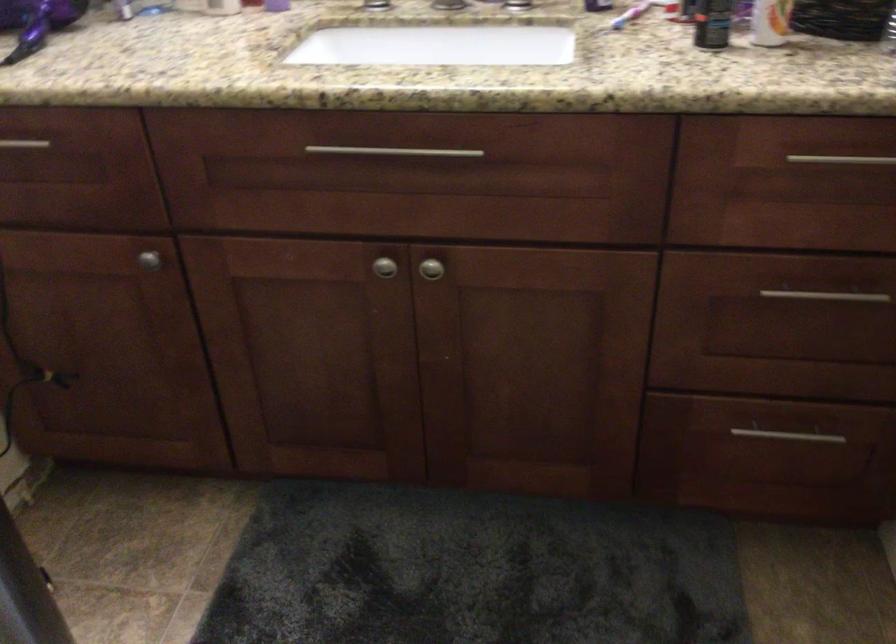
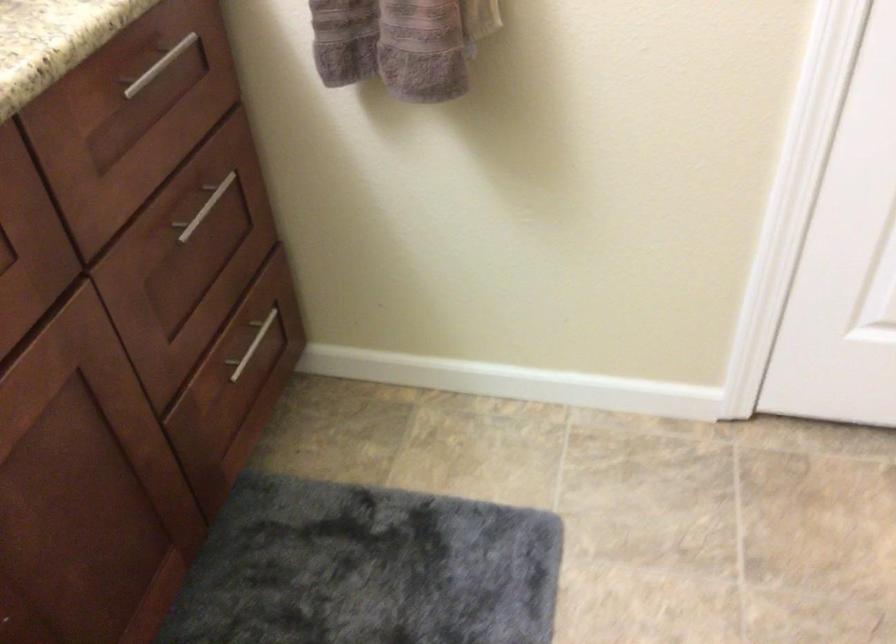
Find the pixel in the second image that matches the point at 821,290 in the first image.

(203, 207)